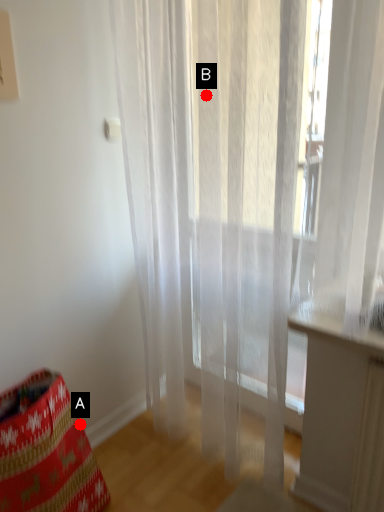
Question: Two points are circled on the image, labeled by A and B beside each circle. Which point is farther from the camera taking this photo?

Choices:
 (A) A is further
 (B) B is further

Answer: (A)